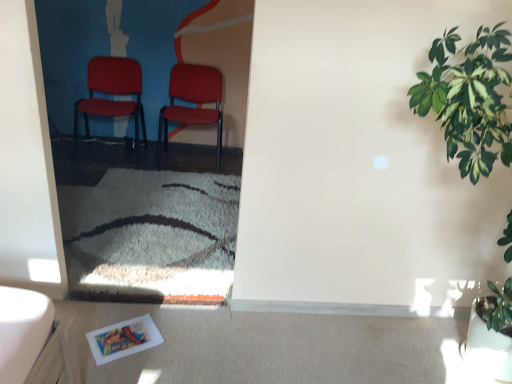
The width and height of the screenshot is (512, 384). What are the coordinates of `matte red chair at center, which is the second chair in left-to-right order` in the screenshot? It's located at (193, 101).

Image resolution: width=512 pixels, height=384 pixels. I want to click on green leafy plant at right, so tap(469, 99).

Which of these two, matte plastic chair at center, which ranks as the first chair in left-to-right order, or green leafy plant at right, is bigger?

Bigger between the two is green leafy plant at right.

Which is nearer, (85, 105) or (496, 302)?

Positioned in front is point (496, 302).

In the scene shown: Can you tell me how much matte plastic chair at center, which ranks as the first chair in left-to-right order, and green leafy plant at right differ in facing direction?

96.2 degrees separate the facing orientations of matte plastic chair at center, which ranks as the first chair in left-to-right order, and green leafy plant at right.

How far apart are matte plastic chair at center, which is the 2th chair from right to left, and green leafy plant at right?

matte plastic chair at center, which is the 2th chair from right to left, is 9.62 feet away from green leafy plant at right.

Do you think green leafy plant at right is within matte red chair at center, which is the second chair in left-to-right order, or outside of it?

green leafy plant at right is outside matte red chair at center, which is the second chair in left-to-right order.

Considering the relative positions of green leafy plant at right and matte red chair at center, marked as the 1th chair in a right-to-left arrangement, in the image provided, is green leafy plant at right behind matte red chair at center, marked as the 1th chair in a right-to-left arrangement,?

No, green leafy plant at right is in front of matte red chair at center, marked as the 1th chair in a right-to-left arrangement.

Is green leafy plant at right facing away from matte red chair at center, which is the second chair in left-to-right order?

That's not correct — green leafy plant at right is not looking away from matte red chair at center, which is the second chair in left-to-right order.

Considering the positions of objects green leafy plant at right and matte red chair at center, which is the second chair in left-to-right order, in the image provided, who is more to the left, green leafy plant at right or matte red chair at center, which is the second chair in left-to-right order,?

matte red chair at center, which is the second chair in left-to-right order, is more to the left.

From the image's perspective, who appears lower, green leafy plant at right or matte plastic chair at center, which ranks as the first chair in left-to-right order?

From the image's view, green leafy plant at right is below.

Between green leafy plant at right and matte plastic chair at center, which ranks as the first chair in left-to-right order, which one appears on the left side from the viewer's perspective?

matte plastic chair at center, which ranks as the first chair in left-to-right order, is more to the left.

Based on the photo, how far apart are green leafy plant at right and matte plastic chair at center, which is the 2th chair from right to left?

green leafy plant at right and matte plastic chair at center, which is the 2th chair from right to left, are 2.93 meters apart.

Considering the relative sizes of matte red chair at center, which is the second chair in left-to-right order, and green leafy plant at right in the image provided, is matte red chair at center, which is the second chair in left-to-right order, smaller than green leafy plant at right?

Yes.

Considering the sizes of objects matte red chair at center, which is the second chair in left-to-right order, and green leafy plant at right in the image provided, who is shorter, matte red chair at center, which is the second chair in left-to-right order, or green leafy plant at right?

matte red chair at center, which is the second chair in left-to-right order.

How far apart are matte red chair at center, which is the second chair in left-to-right order, and green leafy plant at right?

matte red chair at center, which is the second chair in left-to-right order, is 2.53 meters from green leafy plant at right.

In the scene shown: What's the angular difference between matte plastic chair at center, which ranks as the first chair in left-to-right order, and matte red chair at center, marked as the 1th chair in a right-to-left arrangement,'s facing directions?

matte plastic chair at center, which ranks as the first chair in left-to-right order, and matte red chair at center, marked as the 1th chair in a right-to-left arrangement, are facing 9.1 degrees away from each other.

How distant is matte plastic chair at center, which ranks as the first chair in left-to-right order, from matte red chair at center, marked as the 1th chair in a right-to-left arrangement?

matte plastic chair at center, which ranks as the first chair in left-to-right order, and matte red chair at center, marked as the 1th chair in a right-to-left arrangement, are 19.48 inches apart from each other.

Does matte plastic chair at center, which ranks as the first chair in left-to-right order, appear on the right side of matte red chair at center, marked as the 1th chair in a right-to-left arrangement?

In fact, matte plastic chair at center, which ranks as the first chair in left-to-right order, is to the left of matte red chair at center, marked as the 1th chair in a right-to-left arrangement.

Can you see matte plastic chair at center, which ranks as the first chair in left-to-right order, touching matte red chair at center, which is the second chair in left-to-right order?

No, matte plastic chair at center, which ranks as the first chair in left-to-right order, is not beside matte red chair at center, which is the second chair in left-to-right order.

From the picture: Is matte red chair at center, which is the second chair in left-to-right order, not within matte plastic chair at center, which ranks as the first chair in left-to-right order?

Yes, matte red chair at center, which is the second chair in left-to-right order, is outside of matte plastic chair at center, which ranks as the first chair in left-to-right order.

Is matte red chair at center, which is the second chair in left-to-right order, turned away from matte plastic chair at center, which ranks as the first chair in left-to-right order?

That's not correct — matte red chair at center, which is the second chair in left-to-right order, is not looking away from matte plastic chair at center, which ranks as the first chair in left-to-right order.

Visually, is matte red chair at center, marked as the 1th chair in a right-to-left arrangement, positioned to the left or to the right of matte plastic chair at center, which ranks as the first chair in left-to-right order?

Clearly, matte red chair at center, marked as the 1th chair in a right-to-left arrangement, is on the right of matte plastic chair at center, which ranks as the first chair in left-to-right order, in the image.

Considering the sizes of matte red chair at center, which is the second chair in left-to-right order, and matte plastic chair at center, which ranks as the first chair in left-to-right order, in the image, is matte red chair at center, which is the second chair in left-to-right order, bigger or smaller than matte plastic chair at center, which ranks as the first chair in left-to-right order,?

matte red chair at center, which is the second chair in left-to-right order, is smaller than matte plastic chair at center, which ranks as the first chair in left-to-right order.

This screenshot has height=384, width=512. What are the coordinates of `chair that is the 2nd object located above the green leafy plant at right (from the image's perspective)` in the screenshot? It's located at (112, 93).

Identify the location of chair that is the 2nd one below the green leafy plant at right (from a real-world perspective). (193, 101).

When comparing their distances from green leafy plant at right, does matte red chair at center, marked as the 1th chair in a right-to-left arrangement, or matte plastic chair at center, which is the 2th chair from right to left, seem closer?

matte red chair at center, marked as the 1th chair in a right-to-left arrangement.

Looking at the image, which one is located further to matte plastic chair at center, which is the 2th chair from right to left, matte red chair at center, marked as the 1th chair in a right-to-left arrangement, or green leafy plant at right?

green leafy plant at right is positioned further to the anchor matte plastic chair at center, which is the 2th chair from right to left.

Looking at the image, which one is located closer to matte red chair at center, which is the second chair in left-to-right order, green leafy plant at right or matte plastic chair at center, which is the 2th chair from right to left?

Based on the image, matte plastic chair at center, which is the 2th chair from right to left, appears to be nearer to matte red chair at center, which is the second chair in left-to-right order.

Considering their positions, is green leafy plant at right positioned further to matte plastic chair at center, which is the 2th chair from right to left, than matte red chair at center, which is the second chair in left-to-right order?

green leafy plant at right is positioned further to the anchor matte plastic chair at center, which is the 2th chair from right to left.

Considering their positions, is matte plastic chair at center, which ranks as the first chair in left-to-right order, positioned further to green leafy plant at right than matte red chair at center, which is the second chair in left-to-right order?

The object further to green leafy plant at right is matte plastic chair at center, which ranks as the first chair in left-to-right order.

Based on their spatial positions, is matte plastic chair at center, which ranks as the first chair in left-to-right order, or green leafy plant at right further from matte red chair at center, marked as the 1th chair in a right-to-left arrangement?

green leafy plant at right is further to matte red chair at center, marked as the 1th chair in a right-to-left arrangement.

Find the location of a particular element. The width and height of the screenshot is (512, 384). chair between green leafy plant at right and matte red chair at center, which is the second chair in left-to-right order, in the front-back direction is located at coordinates (112, 93).